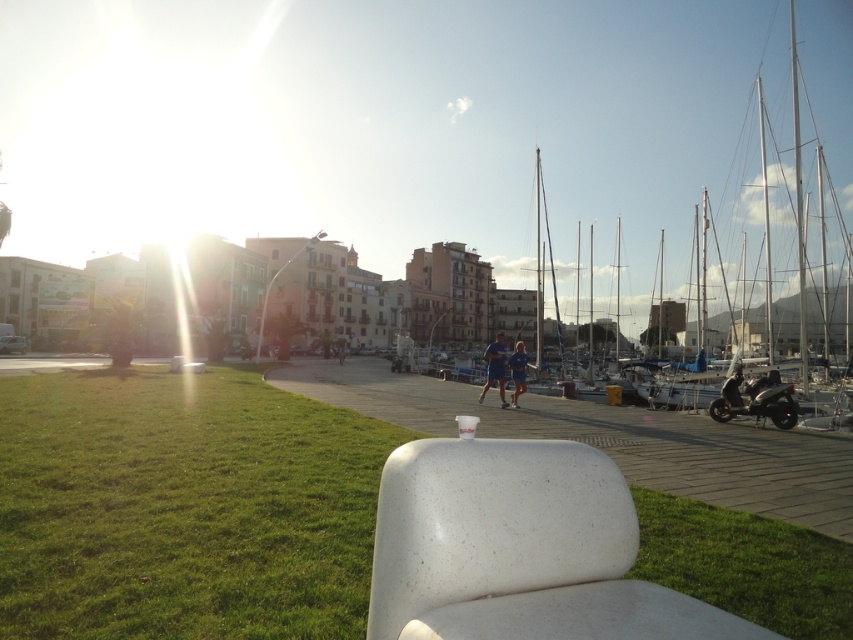
From the picture: You are a photographer planning to capture a wide shot of the waterfront scene. You want to ensure both the white sailboat at center and the green grass at lower left are clearly visible in the frame. Given their sizes, which object might require you to adjust your camera angle or position to include it properly?

The white sailboat at center is larger in size than the green grass at lower left, so it might require adjusting the camera angle or position to ensure it fits within the frame while still capturing the green grass at lower left.

You are standing at the grassy area near the white bench and want to walk towards the walkway in the midground. There are two points marked on the path, one at coordinates point (396, 120) and another at point (138, 374). Which point should you aim for first if you want to reach the walkway closest to your current position?

Point (138, 374) is closer to your current position because it is less further to the camera than point (396, 120), so you should aim for point (138, 374) first.

You are standing on the walkway and want to place a small potted plant between the green grass at lower left and the white speckled plastic chair at center. Based on their positions, which object is closer to you where you should start placing the plant?

The green grass at lower left is closer to you than the white speckled plastic chair at center, so you should start placing the plant near the green grass at lower left.